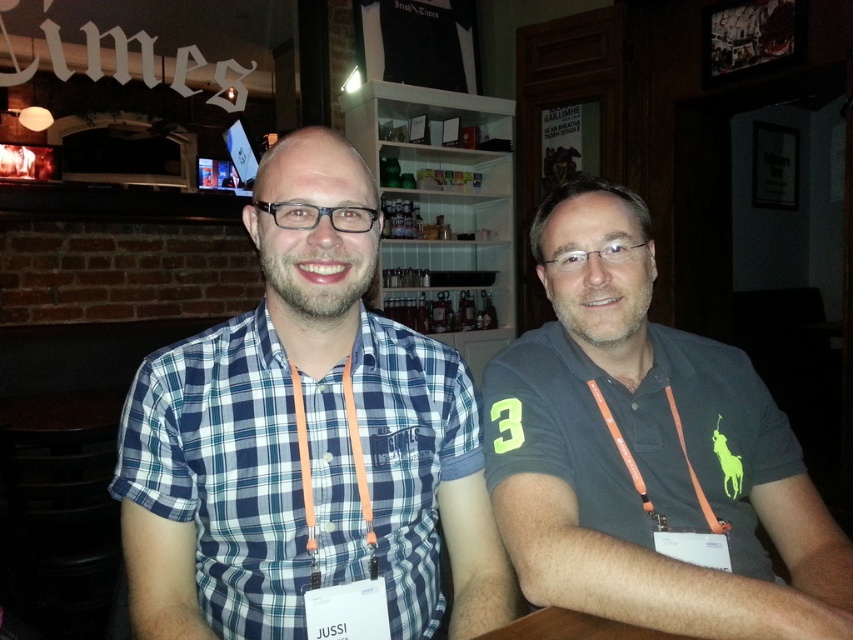
Which is above, blue plaid shirt at center or wooden table at center?

blue plaid shirt at center

Is blue plaid shirt at center positioned behind wooden table at center?

Yes, it is.

Who is more distant from viewer, (286, 528) or (550, 637)?

Point (286, 528)

The image size is (853, 640). Find the location of `blue plaid shirt at center`. blue plaid shirt at center is located at coordinates (305, 440).

Does point (299, 205) lie behind point (788, 467)?

No.

Is blue plaid shirt at center wider than dark gray polo shirt at right?

Yes, blue plaid shirt at center is wider than dark gray polo shirt at right.

Which is in front, point (241, 404) or point (546, 248)?

Point (241, 404) is more forward.

This screenshot has height=640, width=853. What are the coordinates of `blue plaid shirt at center` in the screenshot? It's located at (305, 440).

You are a GUI agent. You are given a task and a screenshot of the screen. Output one action in this format:
    pyautogui.click(x=<x>, y=<y>)
    Task: Click on the dark gray polo shirt at right
    
    Given the screenshot: What is the action you would take?
    pyautogui.click(x=648, y=452)

Which of these two, dark gray polo shirt at right or wooden table at center, stands taller?

dark gray polo shirt at right is taller.

You are a GUI agent. You are given a task and a screenshot of the screen. Output one action in this format:
    pyautogui.click(x=<x>, y=<y>)
    Task: Click on the dark gray polo shirt at right
    Image resolution: width=853 pixels, height=640 pixels.
    Given the screenshot: What is the action you would take?
    point(648,452)